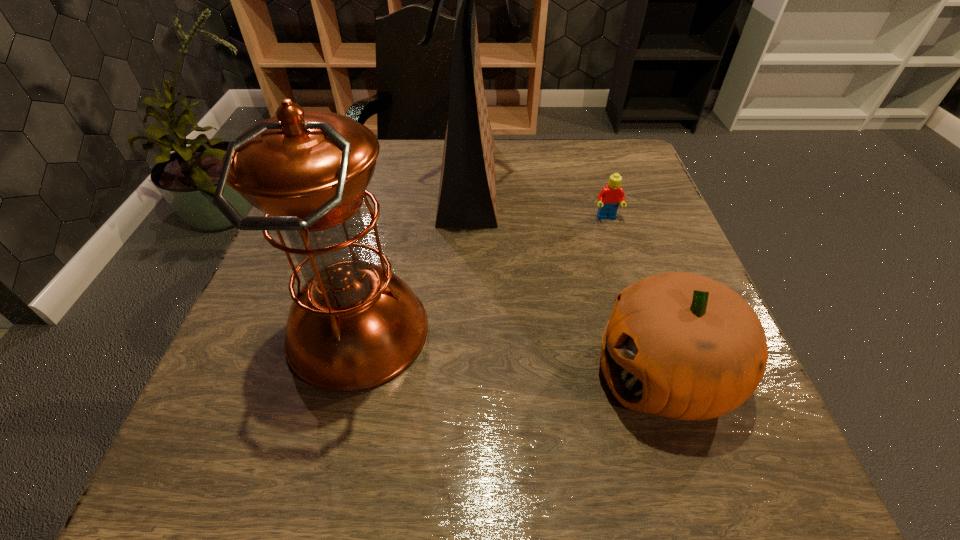
In order to click on object at the far edge in this screenshot , I will do `click(467, 194)`.

I want to click on object at the near edge, so click(680, 345).

The height and width of the screenshot is (540, 960). Find the location of `object positioned at the left edge`. object positioned at the left edge is located at coordinates (353, 325).

Locate an element on the screen. This screenshot has height=540, width=960. pumpkin present at the right edge is located at coordinates (680, 345).

Where is `Lego that is at the right edge`? Lego that is at the right edge is located at coordinates (610, 197).

Where is `object at the near right corner`? The image size is (960, 540). object at the near right corner is located at coordinates (680, 345).

This screenshot has width=960, height=540. I want to click on vacant space at the far edge of the desktop, so click(516, 188).

The height and width of the screenshot is (540, 960). Find the location of `vacant space at the near edge`. vacant space at the near edge is located at coordinates [x=639, y=445].

Where is `vacant space at the left edge`? This screenshot has width=960, height=540. vacant space at the left edge is located at coordinates click(x=255, y=416).

In the image, there is a desktop. What are the coordinates of `vacant space at the far left corner` in the screenshot? It's located at (379, 155).